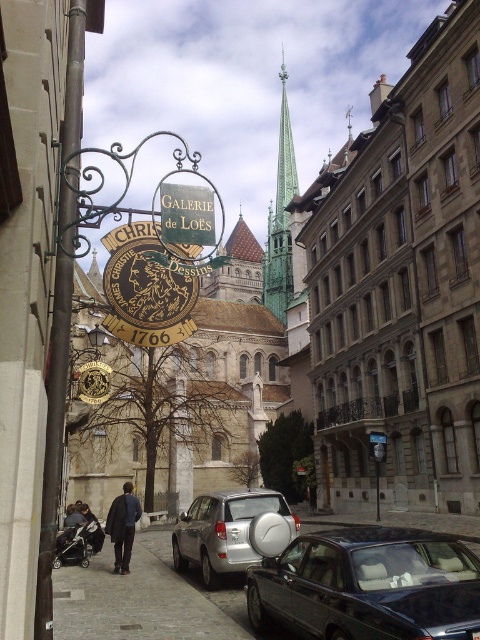
Question: Which point is farther to the camera?

Choices:
 (A) stone church at center
 (B) shiny black car at lower right
 (C) golden stone church at center

Answer: (A)

Question: Is gray cobblestone pavement at lower center below green wood sign at center?

Choices:
 (A) yes
 (B) no

Answer: (A)

Question: Considering the real-world distances, which object is closest to the gray cobblestone pavement at lower center?

Choices:
 (A) green wood sign at center
 (B) stone church at center
 (C) wooden signboard at center

Answer: (A)

Question: Does shiny black car at lower right have a greater width compared to green wood sign at center?

Choices:
 (A) yes
 (B) no

Answer: (A)

Question: Which object is closer to the camera taking this photo?

Choices:
 (A) golden stone church at center
 (B) wooden signboard at center
 (C) green stone spire at upper center
 (D) stone church at center

Answer: (A)

Question: Is stone church at center thinner than golden stone church at center?

Choices:
 (A) no
 (B) yes

Answer: (B)